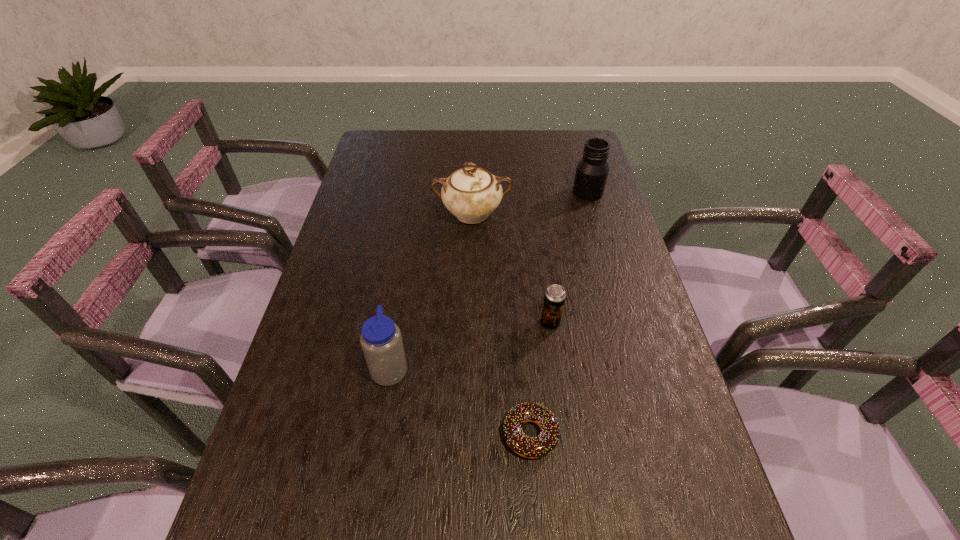
The width and height of the screenshot is (960, 540). I want to click on free space located 0.240m with a carrying loop on the side of the water bottle, so click(x=517, y=367).

Where is `vacant space located 0.350m on the front of the third nearest object`? The image size is (960, 540). vacant space located 0.350m on the front of the third nearest object is located at coordinates coord(573,485).

Identify the location of vacant region located on the left of the doughnut. The image size is (960, 540). (325, 434).

I want to click on object positioned at the right edge, so click(x=592, y=170).

In the image, there is a desktop. What are the coordinates of `vacant region at the far edge` in the screenshot? It's located at (491, 155).

Where is `free space at the left edge of the desktop`? The image size is (960, 540). free space at the left edge of the desktop is located at coordinates (336, 379).

Where is `vacant space at the right edge of the desktop`? Image resolution: width=960 pixels, height=540 pixels. vacant space at the right edge of the desktop is located at coordinates (682, 454).

Identify the location of free space at the far left corner. pos(401,137).

The image size is (960, 540). Identify the location of blank space at the far right corner of the desktop. (558, 137).

At what (x,y) coordinates should I click in order to perform the action: click on empty space between the chinaware and the nearest object. Please return your answer as a coordinate pair (x, y). The height and width of the screenshot is (540, 960). Looking at the image, I should click on (501, 324).